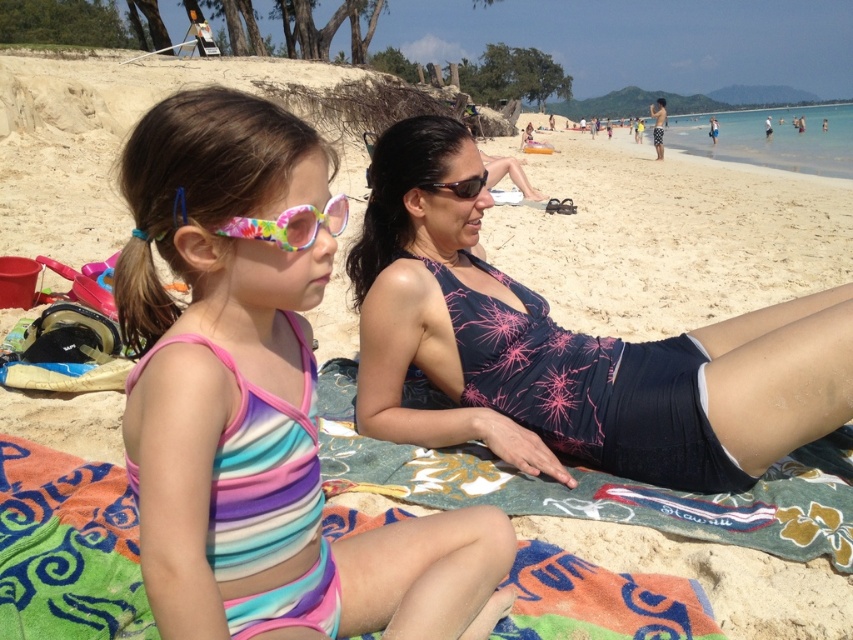
Who is shorter, tie-dye plastic goggles at center or black plastic sunglasses at center?

black plastic sunglasses at center

Can you confirm if tie-dye plastic goggles at center is positioned to the right of black plastic sunglasses at center?

In fact, tie-dye plastic goggles at center is to the left of black plastic sunglasses at center.

Locate an element on the screen. tie-dye plastic goggles at center is located at coordinates (291, 225).

Identify the location of tie-dye plastic goggles at center. (291, 225).

Is dark blue swimsuit at center smaller than tie-dye plastic goggles at center?

Actually, dark blue swimsuit at center might be larger than tie-dye plastic goggles at center.

Identify the location of dark blue swimsuit at center. (569, 349).

Who is positioned more to the left, striped fabric swimsuit at center or multicolored fabric towel at center?

multicolored fabric towel at center is more to the left.

Between striped fabric swimsuit at center and multicolored fabric towel at center, which one is positioned lower?

multicolored fabric towel at center is below.

Which is behind, point (132, 148) or point (630, 625)?

The point (630, 625) is more distant.

Locate an element on the screen. This screenshot has width=853, height=640. striped fabric swimsuit at center is located at coordinates (258, 404).